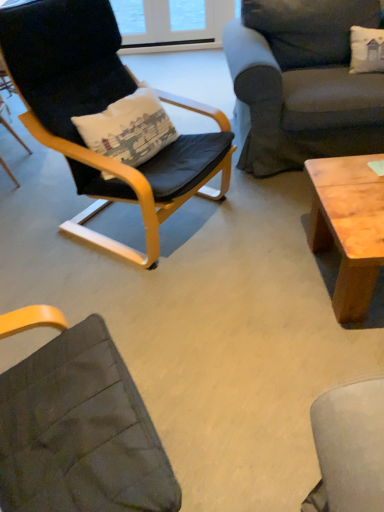
The image size is (384, 512). I want to click on vacant space to the right of black leather chair at left, which is the second chair from left to right, so click(260, 228).